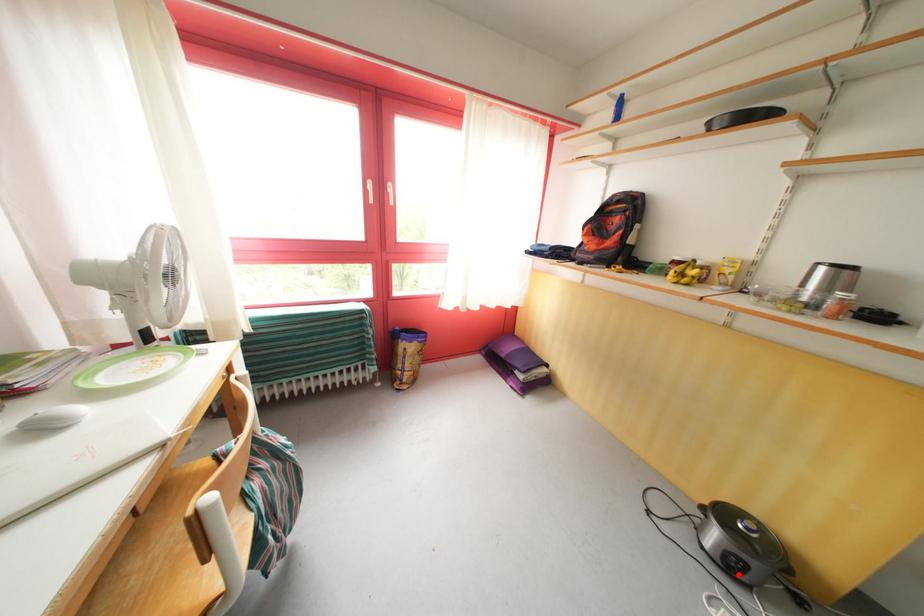
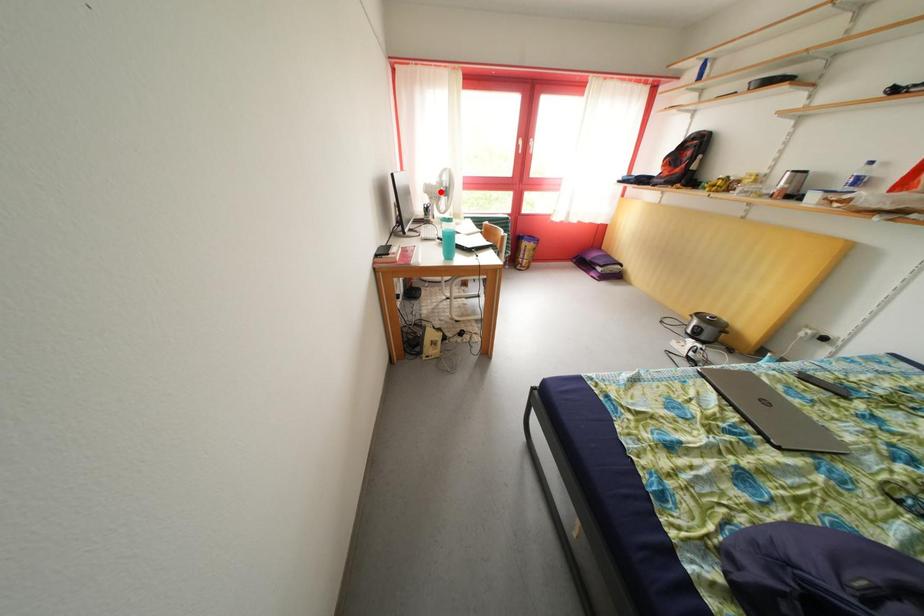
I am providing you with two images of the same scene from different viewpoints. A red point is marked on the first image and another point is marked on the second image. Does the point marked in image1 correspond to the same location as the one in image2?

No